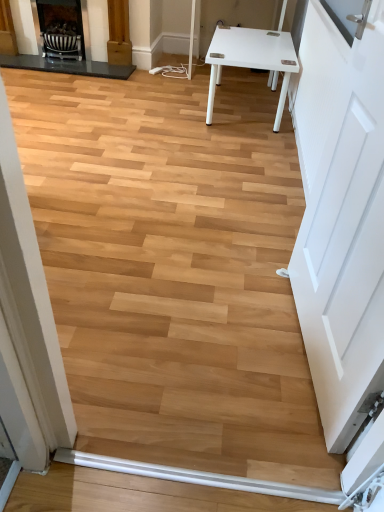
What is the approximate width of white matte door at right?

6.63 inches.

You are a GUI agent. You are given a task and a screenshot of the screen. Output one action in this format:
    pyautogui.click(x=<x>, y=<y>)
    Task: Click on the matte black fireplace at upper left, acting as the 2th fireplace starting from the left
    This screenshot has width=384, height=512.
    Given the screenshot: What is the action you would take?
    pyautogui.click(x=62, y=26)

Is matte black fireplace at upper left, the 2th fireplace positioned from the right, not within white smooth baseboard at lower center?

Yes, matte black fireplace at upper left, the 2th fireplace positioned from the right, is not within white smooth baseboard at lower center.

Is matte black fireplace at upper left, the 2th fireplace positioned from the right, closer to the viewer compared to white smooth baseboard at lower center?

No, it is not.

From the picture: In terms of width, does matte black fireplace at upper left, the 2th fireplace positioned from the right, look wider or thinner when compared to white smooth baseboard at lower center?

matte black fireplace at upper left, the 2th fireplace positioned from the right, is wider than white smooth baseboard at lower center.

Looking at this image, does matte black fireplace at upper left, the 2th fireplace positioned from the right, appear on the right side of white smooth baseboard at lower center?

Incorrect, matte black fireplace at upper left, the 2th fireplace positioned from the right, is not on the right side of white smooth baseboard at lower center.

Can you tell me how much white matte door at right and white smooth baseboard at lower center differ in facing direction?

There is a 84-degree angle between the facing directions of white matte door at right and white smooth baseboard at lower center.

Locate an element on the screen. Image resolution: width=384 pixels, height=512 pixels. beam below the white matte door at right (from the image's perspective) is located at coordinates (197, 477).

Would you say white matte door at right is a long distance from white smooth baseboard at lower center?

No.

Is point (316, 335) positioned behind point (326, 496)?

That is True.

Considering the relative sizes of white smooth baseboard at lower center and matte black fireplace at upper left, which is the 1th fireplace in left-to-right order, in the image provided, is white smooth baseboard at lower center taller than matte black fireplace at upper left, which is the 1th fireplace in left-to-right order,?

No, white smooth baseboard at lower center is not taller than matte black fireplace at upper left, which is the 1th fireplace in left-to-right order.

Are white smooth baseboard at lower center and matte black fireplace at upper left, which is the 1th fireplace in left-to-right order, beside each other?

They are not placed beside each other.

Which of these two, white smooth baseboard at lower center or matte black fireplace at upper left, which is the 1th fireplace in left-to-right order, is bigger?

matte black fireplace at upper left, which is the 1th fireplace in left-to-right order, is bigger.

Is white smooth baseboard at lower center oriented away from matte black fireplace at upper left, the 2th fireplace positioned from the right?

No, white smooth baseboard at lower center is not facing the opposite direction of matte black fireplace at upper left, the 2th fireplace positioned from the right.

Find the location of `fireplace beneath the matte black fireplace at upper left, the 2th fireplace positioned from the right (from a real-world perspective)`. fireplace beneath the matte black fireplace at upper left, the 2th fireplace positioned from the right (from a real-world perspective) is located at coordinates (62, 26).

Which is closer to the camera, (80,30) or (84,49)?

Positioned in front is point (80,30).

Based on the photo, is matte black fireplace at upper left, which is the 1th fireplace in left-to-right order, touching matte black fireplace at upper left, which is the first fireplace from right to left?

Yes, matte black fireplace at upper left, which is the 1th fireplace in left-to-right order, is with matte black fireplace at upper left, which is the first fireplace from right to left.

Is matte black fireplace at upper left, the 2th fireplace positioned from the right, positioned behind matte black fireplace at upper left, acting as the 2th fireplace starting from the left?

No, the depth of matte black fireplace at upper left, the 2th fireplace positioned from the right, is less than that of matte black fireplace at upper left, acting as the 2th fireplace starting from the left.

From a real-world perspective, is matte black fireplace at upper left, acting as the 2th fireplace starting from the left, positioned under matte black fireplace at upper left, which is the 1th fireplace in left-to-right order, based on gravity?

Yes, from a real-world perspective, matte black fireplace at upper left, acting as the 2th fireplace starting from the left, is under matte black fireplace at upper left, which is the 1th fireplace in left-to-right order.

From the image's perspective, relative to matte black fireplace at upper left, the 2th fireplace positioned from the right, is matte black fireplace at upper left, acting as the 2th fireplace starting from the left, above or below?

Clearly, from the image's perspective, matte black fireplace at upper left, acting as the 2th fireplace starting from the left, is above matte black fireplace at upper left, the 2th fireplace positioned from the right.

Is the surface of matte black fireplace at upper left, which is the first fireplace from right to left, in direct contact with matte black fireplace at upper left, which is the 1th fireplace in left-to-right order?

Yes.

How much distance is there between matte black fireplace at upper left, acting as the 2th fireplace starting from the left, and matte black fireplace at upper left, which is the 1th fireplace in left-to-right order?

A distance of 3.50 inches exists between matte black fireplace at upper left, acting as the 2th fireplace starting from the left, and matte black fireplace at upper left, which is the 1th fireplace in left-to-right order.

Would you say white smooth baseboard at lower center is to the left or to the right of matte black fireplace at upper left, acting as the 2th fireplace starting from the left, in the picture?

Based on their positions, white smooth baseboard at lower center is located to the right of matte black fireplace at upper left, acting as the 2th fireplace starting from the left.

In terms of height, does white smooth baseboard at lower center look taller or shorter compared to matte black fireplace at upper left, which is the first fireplace from right to left?

In the image, white smooth baseboard at lower center appears to be shorter than matte black fireplace at upper left, which is the first fireplace from right to left.

Is matte black fireplace at upper left, which is the first fireplace from right to left, a part of white smooth baseboard at lower center?

No, white smooth baseboard at lower center does not contain matte black fireplace at upper left, which is the first fireplace from right to left.

Between white smooth baseboard at lower center and matte black fireplace at upper left, which is the first fireplace from right to left, which one is positioned behind?

matte black fireplace at upper left, which is the first fireplace from right to left, is behind.

In the scene shown: Is white matte door at right closer to the viewer compared to matte black fireplace at upper left, which is the 1th fireplace in left-to-right order?

Yes.

Are white matte door at right and matte black fireplace at upper left, which is the 1th fireplace in left-to-right order, located far from each other?

Yes.

Considering the positions of point (358, 110) and point (112, 67), is point (358, 110) closer or farther from the camera than point (112, 67)?

Point (358, 110) is closer to the camera than point (112, 67).

In the image, there is a matte black fireplace at upper left, the 2th fireplace positioned from the right. Where is `door below it (from the image's perspective)`? This screenshot has width=384, height=512. door below it (from the image's perspective) is located at coordinates (341, 219).

Starting from the white smooth baseboard at lower center, which fireplace is the 1st one behind? Please provide its 2D coordinates.

[(66, 44)]

I want to click on beam located below the white matte door at right (from the image's perspective), so click(x=197, y=477).

Looking at the image, which one is located closer to white smooth baseboard at lower center, matte black fireplace at upper left, which is the first fireplace from right to left, or white matte door at right?

The object closer to white smooth baseboard at lower center is white matte door at right.

Looking at the image, which one is located further to white matte door at right, white smooth baseboard at lower center or matte black fireplace at upper left, which is the 1th fireplace in left-to-right order?

Among the two, matte black fireplace at upper left, which is the 1th fireplace in left-to-right order, is located further to white matte door at right.

Estimate the real-world distances between objects in this image. Which object is further from white smooth baseboard at lower center, matte black fireplace at upper left, acting as the 2th fireplace starting from the left, or matte black fireplace at upper left, which is the 1th fireplace in left-to-right order?

matte black fireplace at upper left, acting as the 2th fireplace starting from the left, lies further to white smooth baseboard at lower center than the other object.

Looking at this image, estimate the real-world distances between objects in this image. Which object is closer to matte black fireplace at upper left, which is the 1th fireplace in left-to-right order, white smooth baseboard at lower center or white matte door at right?

The object closer to matte black fireplace at upper left, which is the 1th fireplace in left-to-right order, is white matte door at right.

Based on the photo, estimate the real-world distances between objects in this image. Which object is further from white matte door at right, matte black fireplace at upper left, which is the 1th fireplace in left-to-right order, or matte black fireplace at upper left, acting as the 2th fireplace starting from the left?

The object further to white matte door at right is matte black fireplace at upper left, acting as the 2th fireplace starting from the left.

Based on their spatial positions, is white matte door at right or matte black fireplace at upper left, which is the first fireplace from right to left, further from white smooth baseboard at lower center?

Result: matte black fireplace at upper left, which is the first fireplace from right to left, is further to white smooth baseboard at lower center.

Considering their positions, is white smooth baseboard at lower center positioned closer to matte black fireplace at upper left, the 2th fireplace positioned from the right, than matte black fireplace at upper left, which is the first fireplace from right to left?

Based on the image, matte black fireplace at upper left, which is the first fireplace from right to left, appears to be nearer to matte black fireplace at upper left, the 2th fireplace positioned from the right.

Looking at the image, which one is located further to white matte door at right, white smooth baseboard at lower center or matte black fireplace at upper left, acting as the 2th fireplace starting from the left?

Based on the image, matte black fireplace at upper left, acting as the 2th fireplace starting from the left, appears to be further to white matte door at right.

Where is `fireplace between matte black fireplace at upper left, acting as the 2th fireplace starting from the left, and white smooth baseboard at lower center, in the vertical direction`? Image resolution: width=384 pixels, height=512 pixels. fireplace between matte black fireplace at upper left, acting as the 2th fireplace starting from the left, and white smooth baseboard at lower center, in the vertical direction is located at coordinates (66, 44).

Locate an element on the screen. beam located between white matte door at right and matte black fireplace at upper left, acting as the 2th fireplace starting from the left, in the depth direction is located at coordinates (197, 477).

Locate an element on the screen. Image resolution: width=384 pixels, height=512 pixels. beam between white matte door at right and matte black fireplace at upper left, the 2th fireplace positioned from the right, along the z-axis is located at coordinates (197, 477).

The height and width of the screenshot is (512, 384). Find the location of `fireplace between white matte door at right and matte black fireplace at upper left, acting as the 2th fireplace starting from the left, in the front-back direction`. fireplace between white matte door at right and matte black fireplace at upper left, acting as the 2th fireplace starting from the left, in the front-back direction is located at coordinates (66, 44).